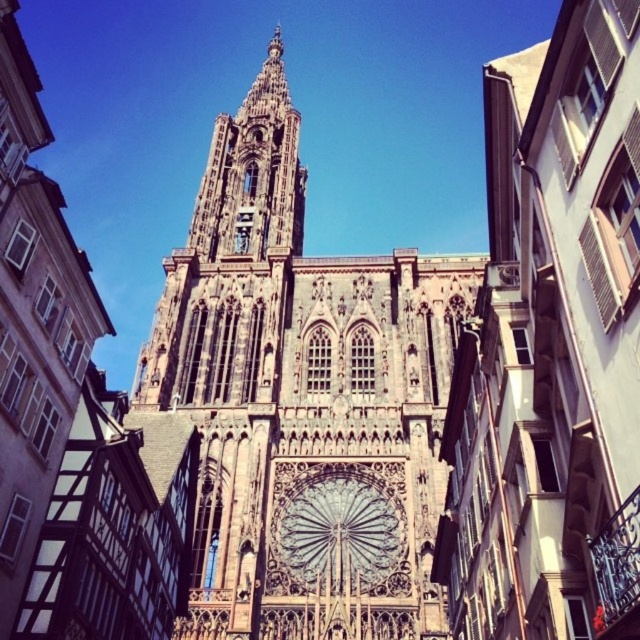
Which is behind, point (301, 257) or point (369, 481)?

Positioned behind is point (301, 257).

Does point (218, 440) come closer to viewer compared to point (285, 502)?

No, (218, 440) is behind (285, 502).

In order to click on brown stone tower at center in this screenshot , I will do `click(304, 400)`.